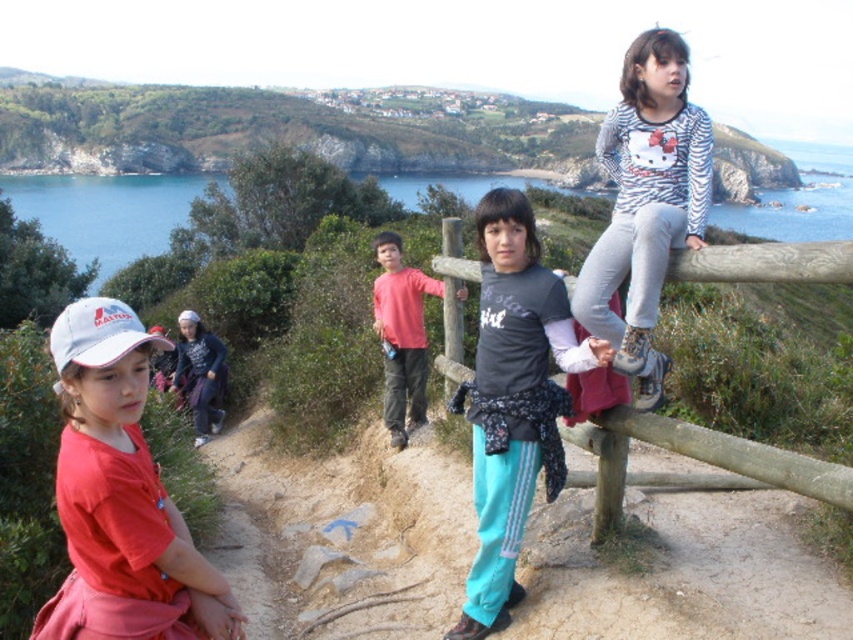
Question: Among these objects, which one is farthest from the camera?

Choices:
 (A) red matte cap at left
 (B) wooden at center
 (C) green grassy hillside at upper center

Answer: (C)

Question: Which object is farther from the camera taking this photo?

Choices:
 (A) red matte cap at left
 (B) striped cotton shirt at upper right
 (C) green grassy hillside at upper center

Answer: (C)

Question: Which of these objects is positioned farthest from the striped cotton shirt at upper right?

Choices:
 (A) matte red shirt at center
 (B) red matte cap at left

Answer: (B)

Question: Does green grassy hillside at upper center have a larger size compared to wooden at center?

Choices:
 (A) no
 (B) yes

Answer: (B)

Question: Is the position of red matte cap at left less distant than that of wooden at center?

Choices:
 (A) no
 (B) yes

Answer: (A)

Question: Where is green grassy hillside at upper center located in relation to red matte cap at left in the image?

Choices:
 (A) right
 (B) left

Answer: (B)